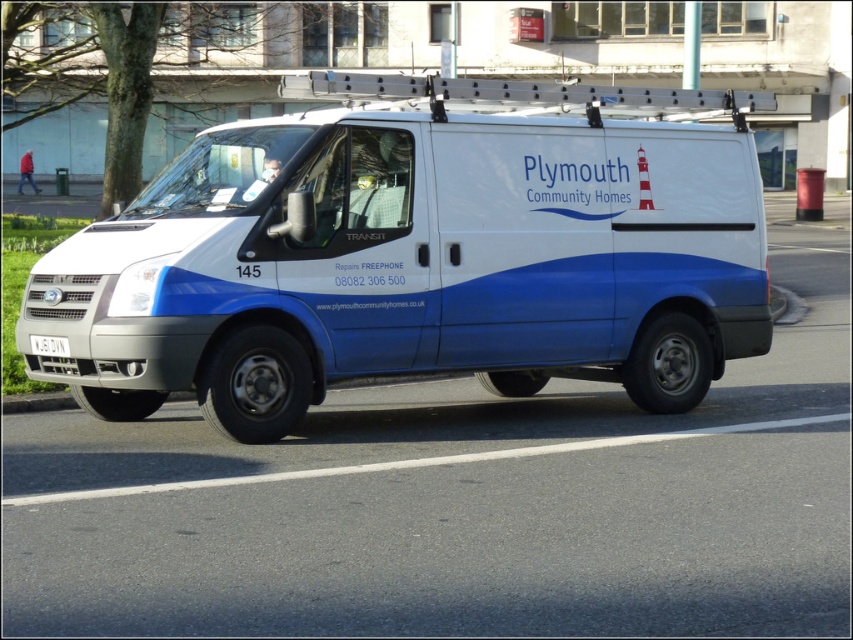
Consider the image. Between white matte van at center and white plastic license plate at center, which one has more height?

Standing taller between the two is white matte van at center.

Where is `white matte van at center`? The image size is (853, 640). white matte van at center is located at coordinates (418, 253).